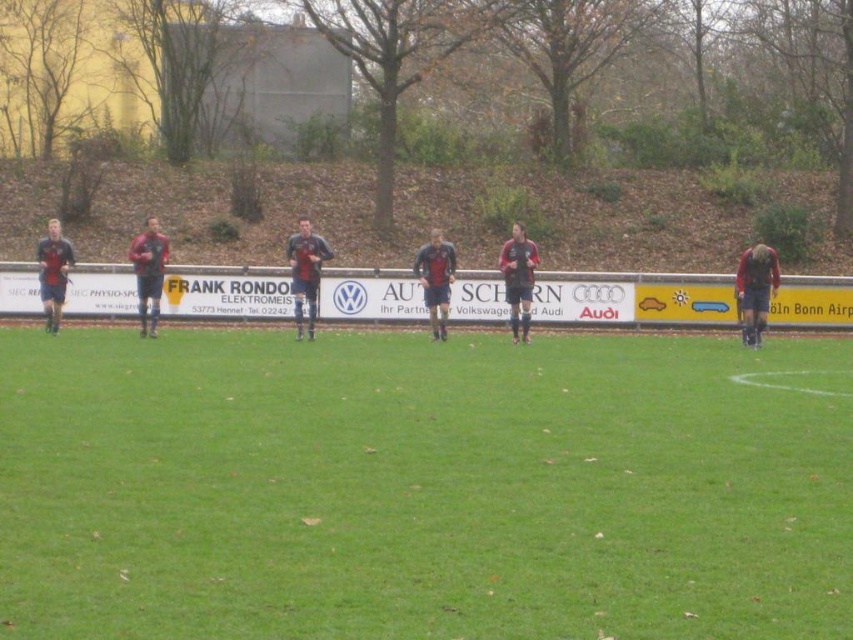
Who is more distant from viewer, (512, 324) or (436, 241)?

The point (512, 324) is behind.

What do you see at coordinates (518, 280) in the screenshot? The height and width of the screenshot is (640, 853). I see `matte red soccer jersey at center` at bounding box center [518, 280].

In order to click on matte red soccer jersey at center in this screenshot , I will do `click(518, 280)`.

Is matte red shirt at center behind matte black soccer player at left?

No, it is in front of matte black soccer player at left.

Is point (436, 305) positioned before point (47, 284)?

No, (436, 305) is behind (47, 284).

Find the location of a particular element. matte red shirt at center is located at coordinates (434, 280).

Which of these two, matte black jersey at left or matte red shirt at center, stands shorter?

Standing shorter between the two is matte red shirt at center.

Is matte black jersey at left closer to camera compared to matte red shirt at center?

That is False.

Does point (160, 280) come behind point (439, 310)?

No, it is in front of (439, 310).

The image size is (853, 640). In order to click on matte black jersey at left in this screenshot , I will do `click(148, 273)`.